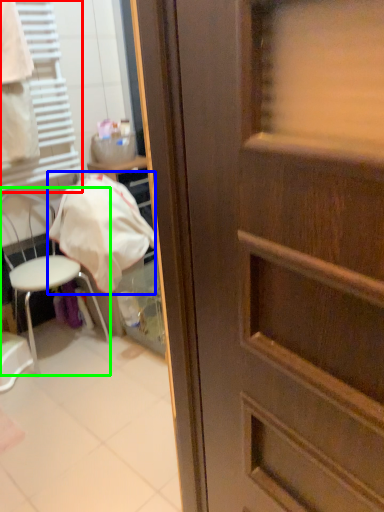
Question: Which is nearer to the shutter (highlighted by a red box)? blanket (highlighted by a blue box) or chair (highlighted by a green box).

Choices:
 (A) blanket
 (B) chair

Answer: (A)